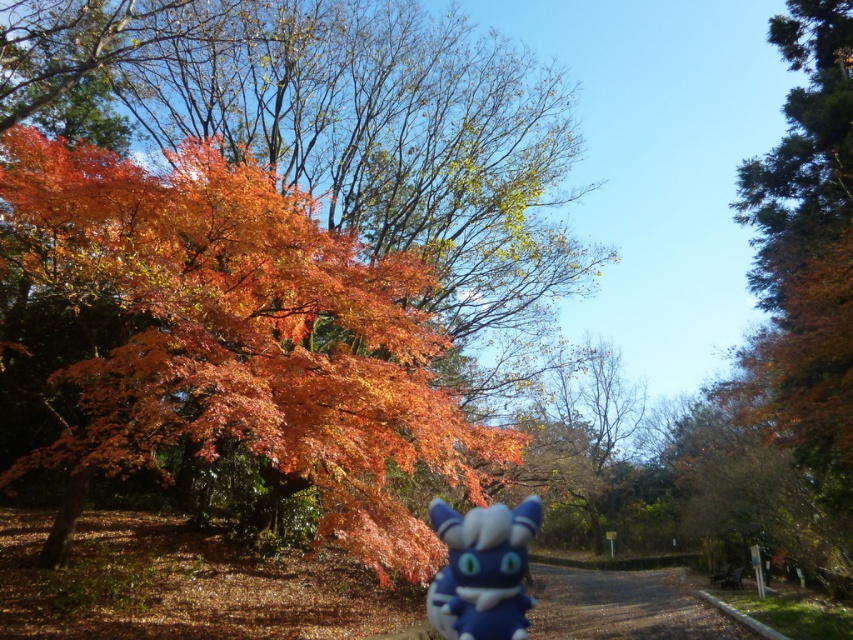
Where is `shiny orange leaves at left`? shiny orange leaves at left is located at coordinates (241, 337).

Measure the distance between point (402, 451) and camera.

They are 8.29 meters apart.

Image resolution: width=853 pixels, height=640 pixels. Find the location of `shiny orange leaves at left`. shiny orange leaves at left is located at coordinates (241, 337).